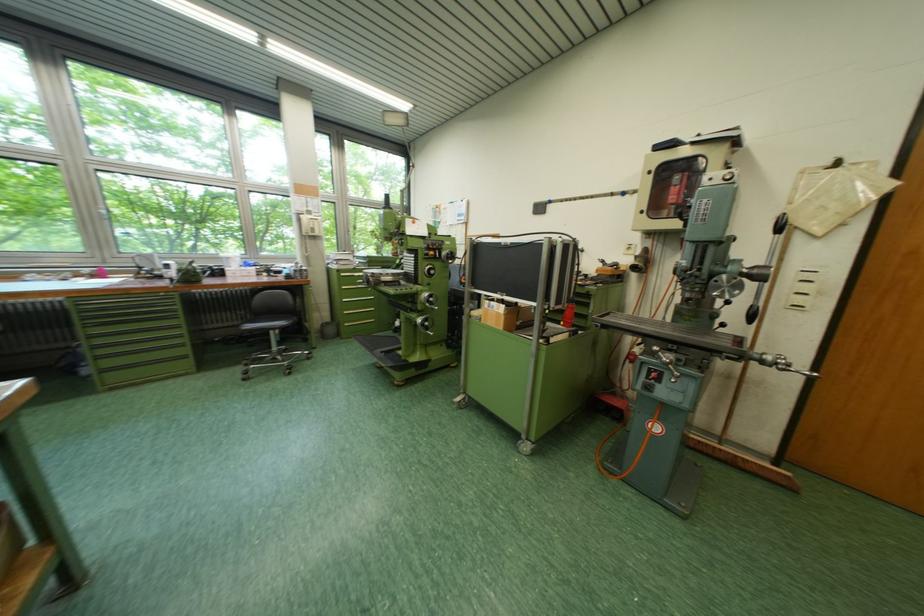
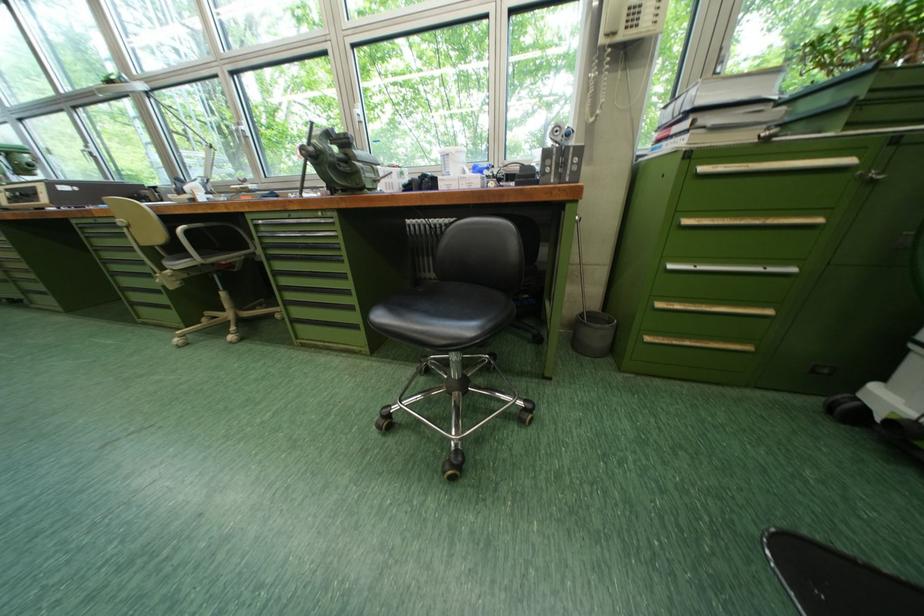
Locate, in the second image, the point that corresponds to (332,326) in the first image.

(589, 315)